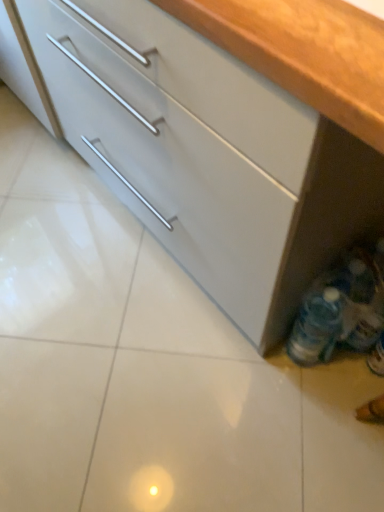
Question: Considering their positions, is translucent plastic bottles at lower right located in front of or behind matte white cabinet at lower right?

Choices:
 (A) front
 (B) behind

Answer: (B)

Question: Considering the positions of translucent plastic bottles at lower right and matte white cabinet at lower right in the image, is translucent plastic bottles at lower right bigger or smaller than matte white cabinet at lower right?

Choices:
 (A) small
 (B) big

Answer: (A)

Question: Considering the positions of point (372, 322) and point (269, 193), is point (372, 322) closer or farther from the camera than point (269, 193)?

Choices:
 (A) closer
 (B) farther

Answer: (B)

Question: From a real-world perspective, is matte white cabinet at lower right above or below translucent plastic bottles at lower right?

Choices:
 (A) above
 (B) below

Answer: (A)

Question: Considering their positions, is matte white cabinet at lower right located in front of or behind translucent plastic bottles at lower right?

Choices:
 (A) front
 (B) behind

Answer: (A)

Question: From the image's perspective, is matte white cabinet at lower right located above or below translucent plastic bottles at lower right?

Choices:
 (A) above
 (B) below

Answer: (A)

Question: Is matte white cabinet at lower right taller or shorter than translucent plastic bottles at lower right?

Choices:
 (A) tall
 (B) short

Answer: (A)